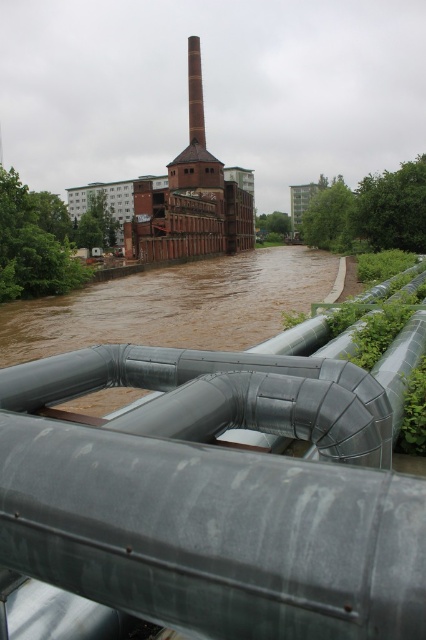
Question: Which is nearer to the brown muddy water at center?

Choices:
 (A) galvanized steel pipes at center
 (B) smooth brick chimney at center

Answer: (A)

Question: Is red brick chimney at center smaller than smooth brick chimney at center?

Choices:
 (A) yes
 (B) no

Answer: (B)

Question: Which point is closer to the camera taking this photo?

Choices:
 (A) (195, 42)
 (B) (192, 136)
 (C) (285, 404)
 (D) (17, 310)

Answer: (C)

Question: In this image, where is galvanized steel pipes at center located relative to smooth brick chimney at center?

Choices:
 (A) below
 (B) above

Answer: (A)

Question: Does galvanized steel pipes at center appear on the right side of smooth brick chimney at center?

Choices:
 (A) no
 (B) yes

Answer: (B)

Question: Which object is farther from the camera taking this photo?

Choices:
 (A) smooth brick chimney at center
 (B) galvanized steel pipes at center
 (C) brown muddy water at center
 (D) red brick chimney at center

Answer: (A)